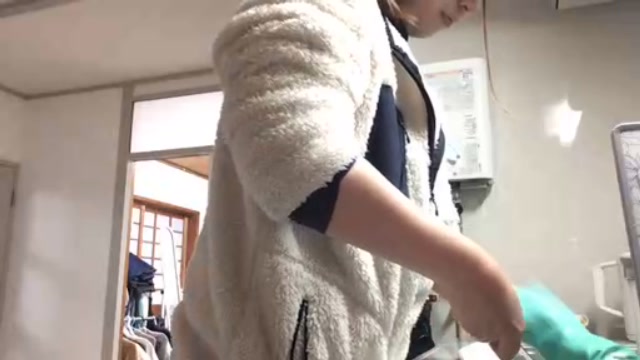
Find the location of a particular element. light shining on wall is located at coordinates (564, 122).